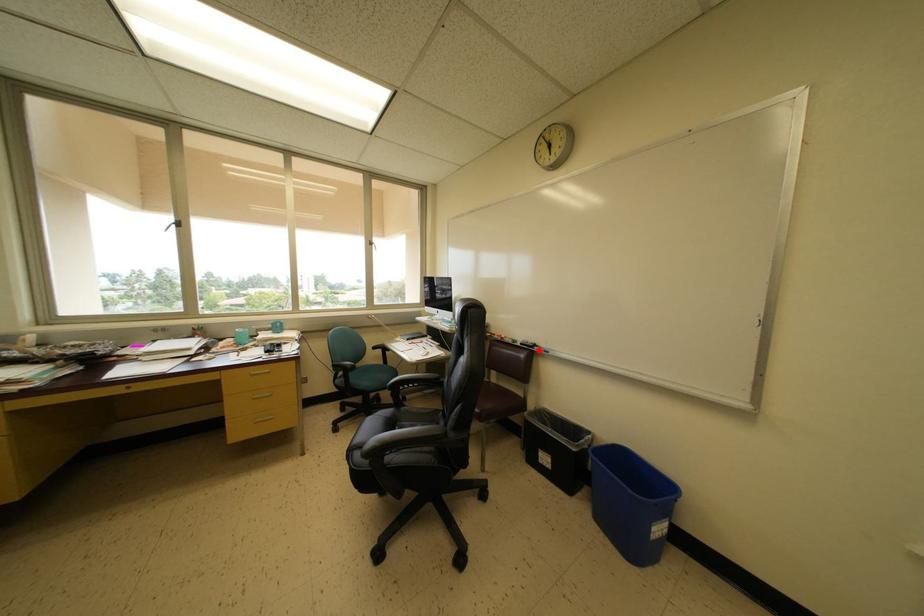
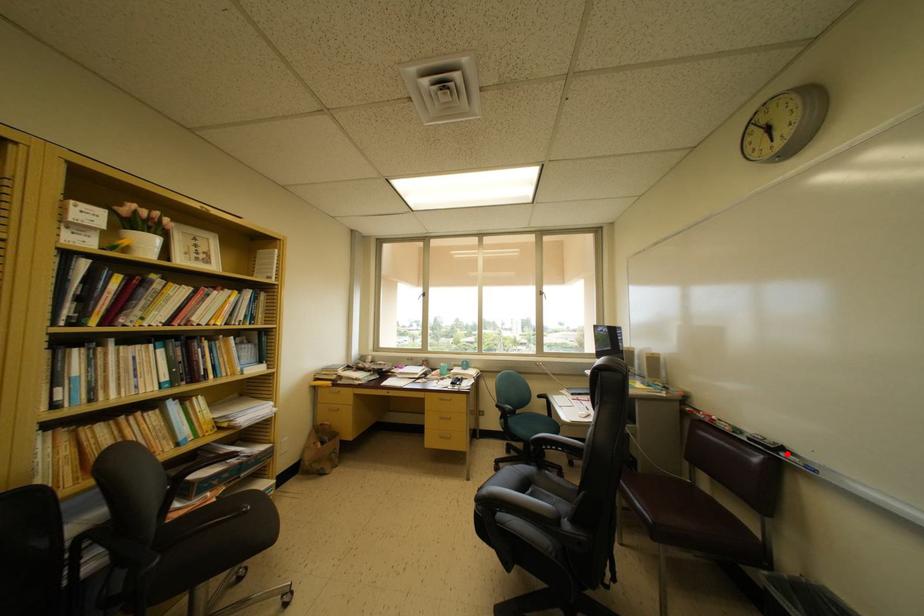
I am providing you with two images of the same scene from different viewpoints. A red point is marked on the first image and another point is marked on the second image. Do the highlighted points in image1 and image2 indicate the same real-world spot?

Yes